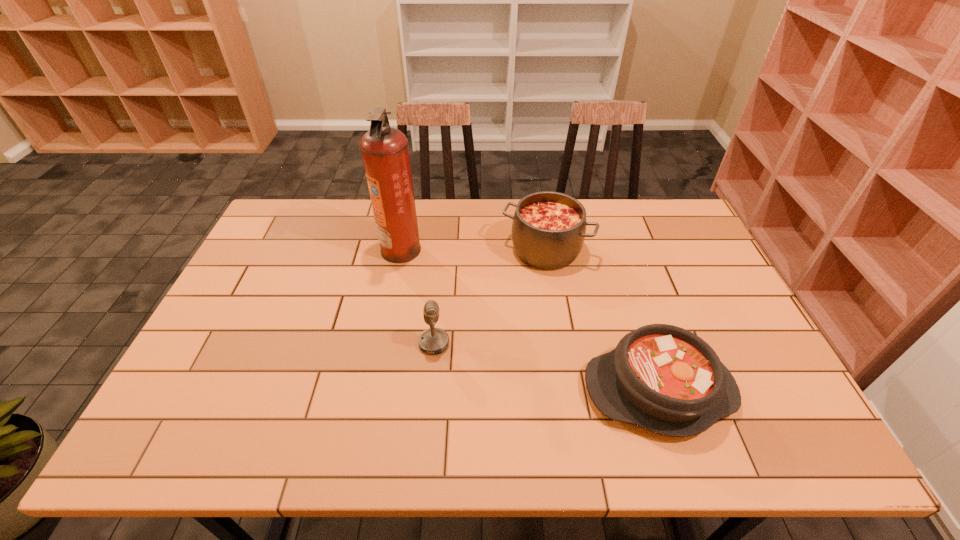
Select which object is the second closest to the nearer casserole. Please provide its 2D coordinates. Your answer should be formatted as a tuple, i.e. [(x, y)], where the tuple contains the x and y coordinates of a point satisfying the conditions above.

[(434, 340)]

Locate which object ranks third in proximity to the taller casserole. Please provide its 2D coordinates. Your answer should be formatted as a tuple, i.e. [(x, y)], where the tuple contains the x and y coordinates of a point satisfying the conditions above.

[(663, 378)]

This screenshot has height=540, width=960. Find the location of `vacant region that satisfies the following two spatial constraints: 1. at the nozzle of the tallest object; 2. on the left side of the shorter casserole`. vacant region that satisfies the following two spatial constraints: 1. at the nozzle of the tallest object; 2. on the left side of the shorter casserole is located at coordinates (373, 390).

Identify the location of free space in the image that satisfies the following two spatial constraints: 1. on the front side of the taller casserole; 2. on the front-facing side of the microphone. The height and width of the screenshot is (540, 960). (562, 343).

Where is `vacant region that satisfies the following two spatial constraints: 1. on the back side of the nearer casserole; 2. at the nozzle of the tallest object`? This screenshot has height=540, width=960. vacant region that satisfies the following two spatial constraints: 1. on the back side of the nearer casserole; 2. at the nozzle of the tallest object is located at coordinates (612, 249).

You are a GUI agent. You are given a task and a screenshot of the screen. Output one action in this format:
    pyautogui.click(x=<x>, y=<y>)
    Task: Click on the vacant space that satisfies the following two spatial constraints: 1. on the front-facing side of the microphone; 2. on the back side of the nearer casserole
    Image resolution: width=960 pixels, height=540 pixels.
    Given the screenshot: What is the action you would take?
    pyautogui.click(x=430, y=390)

What are the coordinates of `free space in the image that satisfies the following two spatial constraints: 1. at the nozzle of the taller casserole; 2. on the left side of the fire extinguisher` in the screenshot? It's located at pyautogui.click(x=401, y=249).

This screenshot has width=960, height=540. In order to click on vacant space that satisfies the following two spatial constraints: 1. at the nozzle of the farther casserole; 2. on the left side of the fire extinguisher in this screenshot , I will do `click(401, 249)`.

The image size is (960, 540). Find the location of `vacant position in the image that satisfies the following two spatial constraints: 1. on the front side of the taller casserole; 2. on the front-facing side of the microphone`. vacant position in the image that satisfies the following two spatial constraints: 1. on the front side of the taller casserole; 2. on the front-facing side of the microphone is located at coordinates (562, 343).

This screenshot has width=960, height=540. I want to click on vacant point that satisfies the following two spatial constraints: 1. on the front side of the nearer casserole; 2. on the right side of the taller casserole, so click(x=569, y=390).